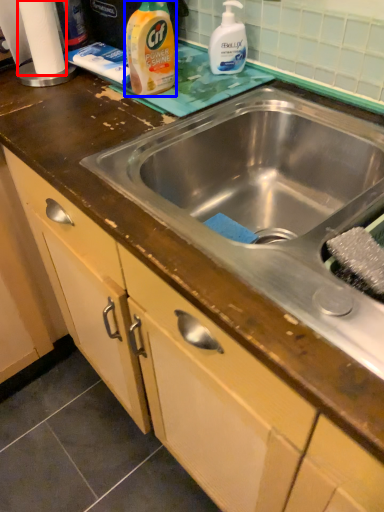
Question: Among these objects, which one is farthest to the camera, toilet paper (highlighted by a red box) or cleaning product (highlighted by a blue box)?

Choices:
 (A) toilet paper
 (B) cleaning product

Answer: (A)